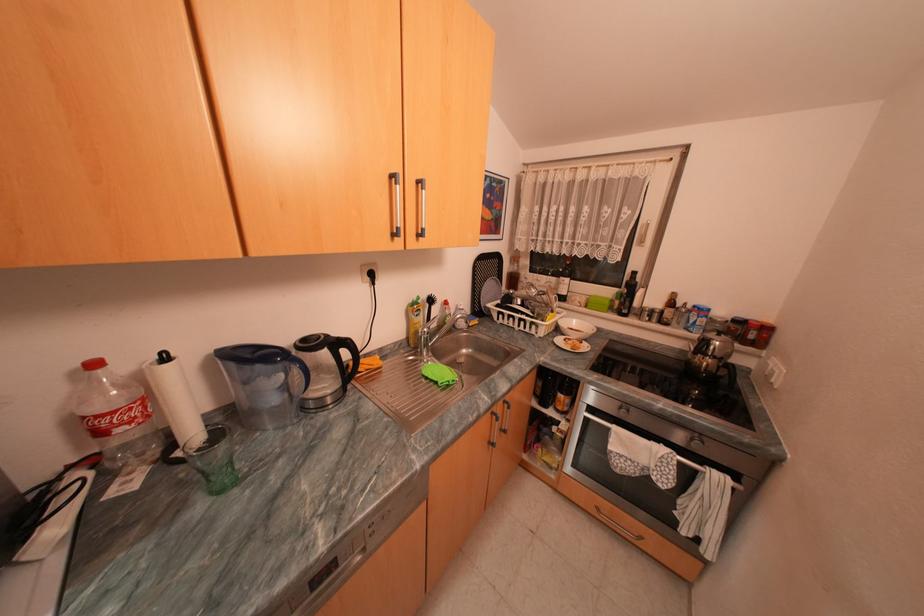
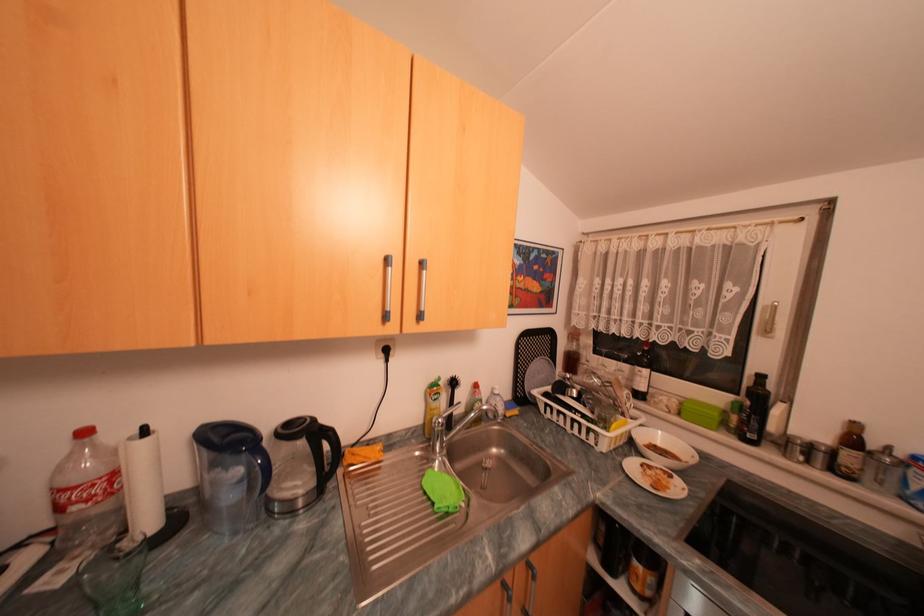
Find the pixel in the second image that matches point 104,363 in the first image.

(94, 432)